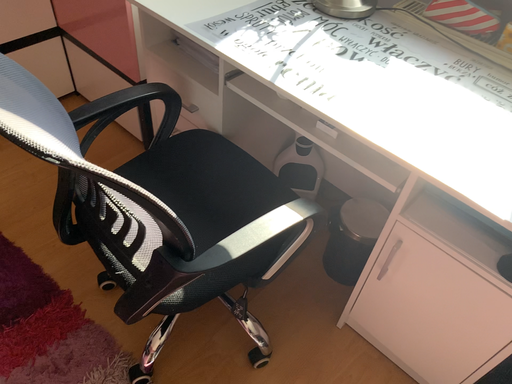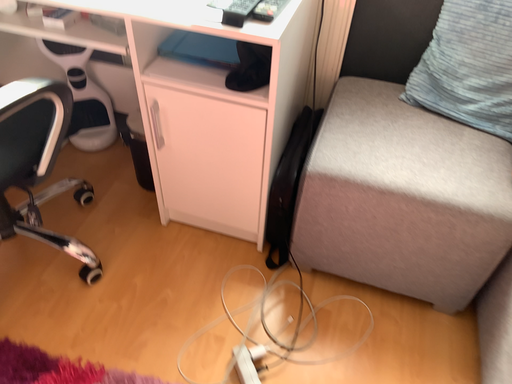
Question: Which way did the camera rotate in the video?

Choices:
 (A) rotated left
 (B) rotated right

Answer: (B)